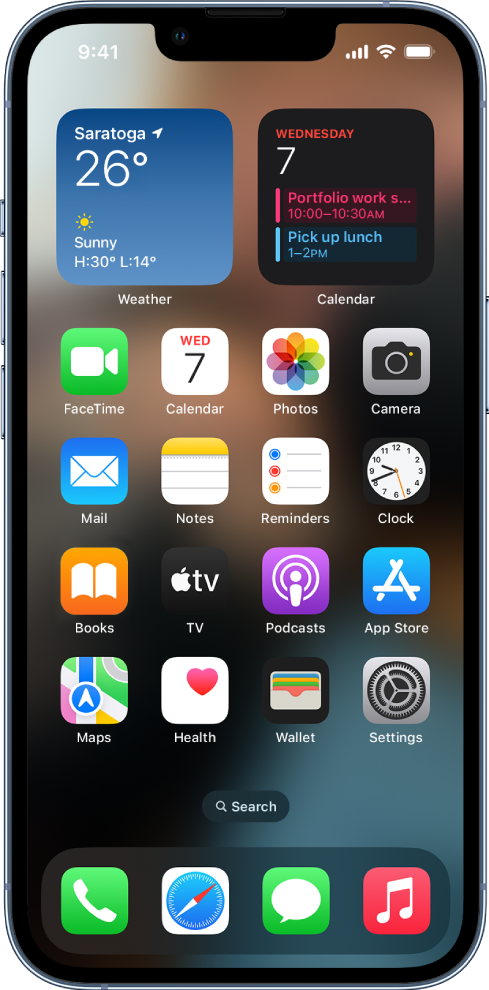
Where is `phone buttons`? Image resolution: width=489 pixels, height=990 pixels. phone buttons is located at coordinates (1, 294), (3, 222), (0, 401), (486, 327).